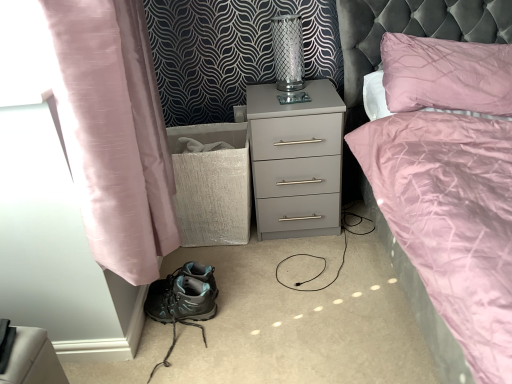
Question: Considering the relative positions of teal fabric hiking boots at lower left and clear glass vase at upper center in the image provided, is teal fabric hiking boots at lower left to the left of clear glass vase at upper center from the viewer's perspective?

Choices:
 (A) yes
 (B) no

Answer: (A)

Question: From a real-world perspective, is teal fabric hiking boots at lower left positioned under clear glass vase at upper center based on gravity?

Choices:
 (A) yes
 (B) no

Answer: (A)

Question: From the image's perspective, would you say teal fabric hiking boots at lower left is positioned over clear glass vase at upper center?

Choices:
 (A) yes
 (B) no

Answer: (B)

Question: Is teal fabric hiking boots at lower left wider than clear glass vase at upper center?

Choices:
 (A) yes
 (B) no

Answer: (A)

Question: Does teal fabric hiking boots at lower left have a smaller size compared to clear glass vase at upper center?

Choices:
 (A) yes
 (B) no

Answer: (A)

Question: In terms of width, does pink silk curtain at left look wider or thinner when compared to clear glass vase at upper center?

Choices:
 (A) thin
 (B) wide

Answer: (B)

Question: Does point (154, 208) appear closer or farther from the camera than point (303, 77)?

Choices:
 (A) farther
 (B) closer

Answer: (B)

Question: Considering the positions of pink silk curtain at left and clear glass vase at upper center in the image, is pink silk curtain at left bigger or smaller than clear glass vase at upper center?

Choices:
 (A) small
 (B) big

Answer: (B)

Question: Is pink silk curtain at left spatially inside clear glass vase at upper center, or outside of it?

Choices:
 (A) inside
 (B) outside

Answer: (B)

Question: From the image's perspective, relative to clear glass vase at upper center, is matte gray nightstand at center above or below?

Choices:
 (A) above
 (B) below

Answer: (B)

Question: Looking at the image, does matte gray nightstand at center seem bigger or smaller compared to clear glass vase at upper center?

Choices:
 (A) small
 (B) big

Answer: (B)

Question: Considering their positions, is matte gray nightstand at center located in front of or behind clear glass vase at upper center?

Choices:
 (A) behind
 (B) front

Answer: (B)

Question: From a real-world perspective, relative to clear glass vase at upper center, is matte gray nightstand at center vertically above or below?

Choices:
 (A) above
 (B) below

Answer: (B)

Question: From a real-world perspective, is clear glass vase at upper center positioned above or below matte gray nightstand at center?

Choices:
 (A) below
 (B) above

Answer: (B)

Question: Is point (274, 29) positioned closer to the camera than point (329, 155)?

Choices:
 (A) farther
 (B) closer

Answer: (A)